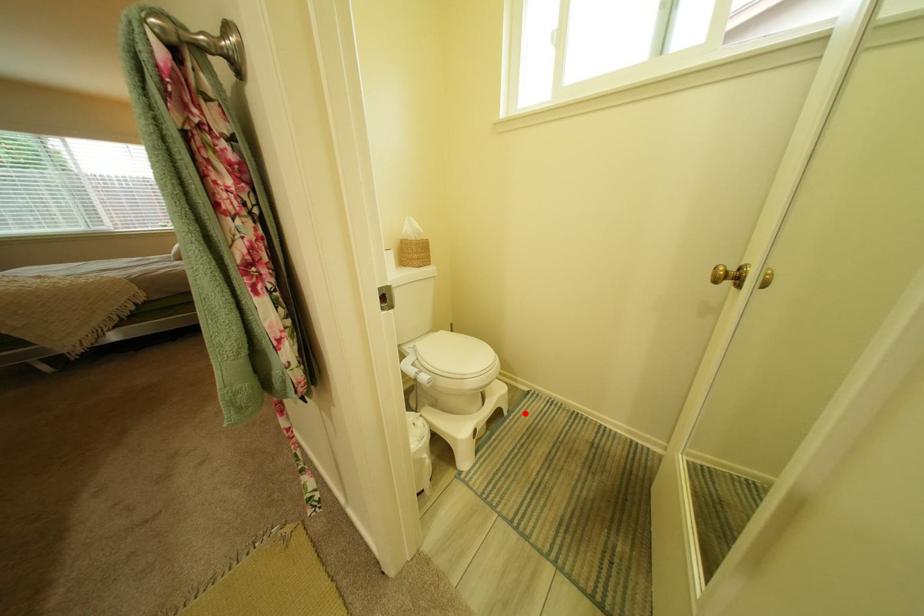
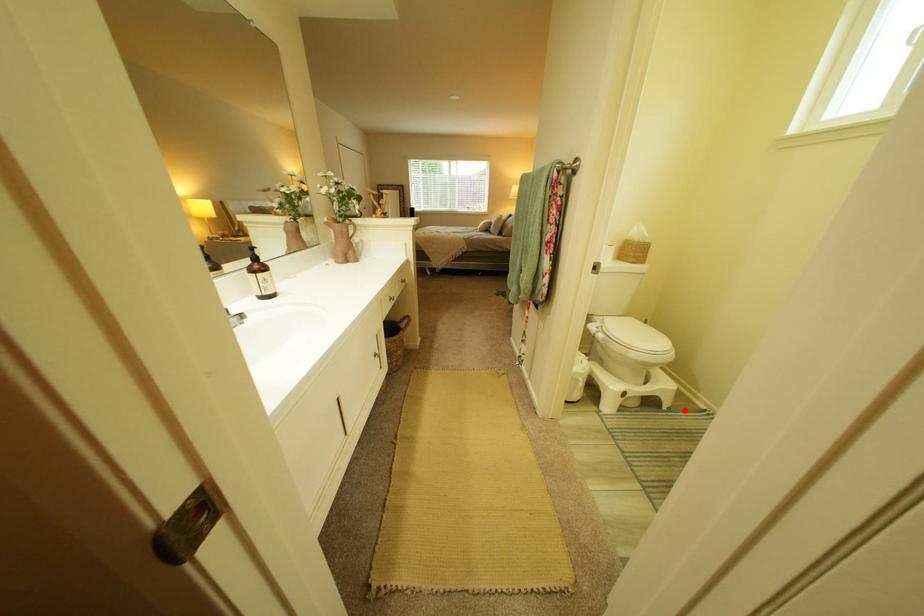
I am providing you with two images of the same scene from different viewpoints. A red point is marked on the first image and another point is marked on the second image. Is the marked point in image1 the same physical position as the marked point in image2?

Yes